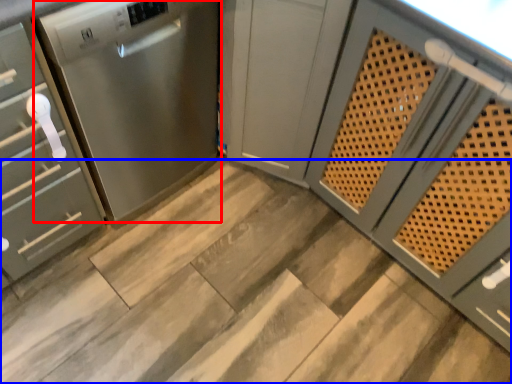
Question: Among these objects, which one is nearest to the camera, home appliance (highlighted by a red box) or stair (highlighted by a blue box)?

Choices:
 (A) home appliance
 (B) stair

Answer: (A)